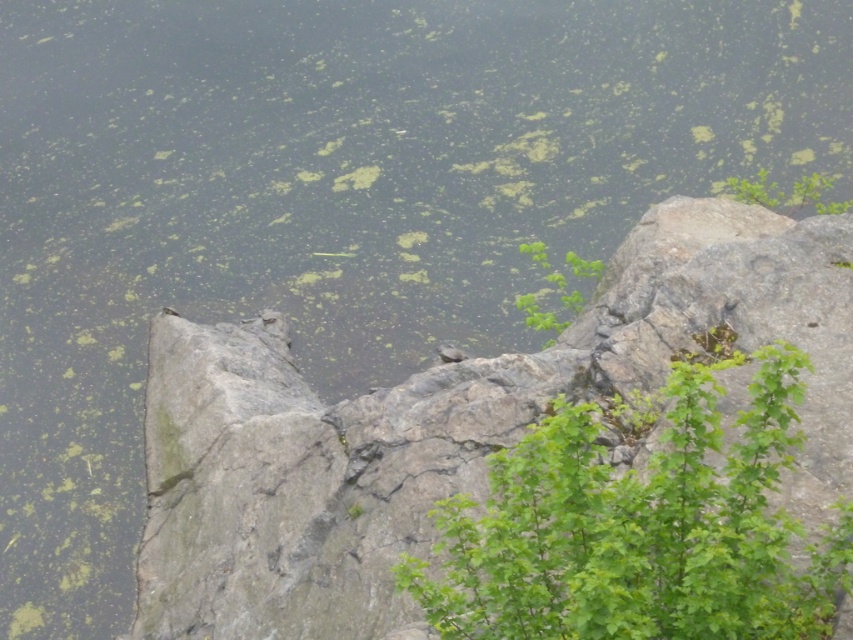
Question: Is green leafy plant at upper center positioned before green leafy plant at upper right?

Choices:
 (A) yes
 (B) no

Answer: (A)

Question: Is green leafy plant at center smaller than green leafy plant at upper right?

Choices:
 (A) no
 (B) yes

Answer: (A)

Question: Which point is farther to the camera?

Choices:
 (A) (503, 536)
 (B) (575, 282)

Answer: (B)

Question: Is green leafy plant at center smaller than green leafy plant at upper center?

Choices:
 (A) yes
 (B) no

Answer: (B)

Question: Among these objects, which one is farthest from the camera?

Choices:
 (A) green leafy plant at center
 (B) green leafy plant at upper center

Answer: (B)

Question: Among these objects, which one is nearest to the camera?

Choices:
 (A) green leafy plant at upper center
 (B) green leafy plant at center

Answer: (B)